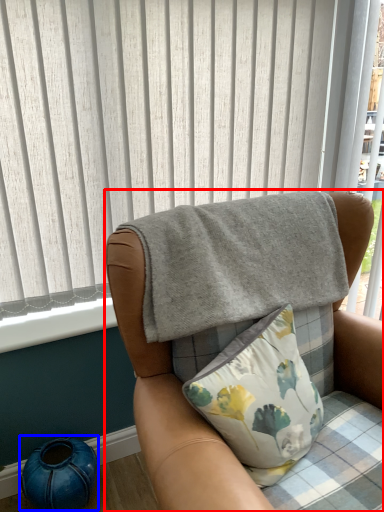
Question: Which of the following is the farthest to the observer, chair (highlighted by a red box) or teal (highlighted by a blue box)?

Choices:
 (A) chair
 (B) teal

Answer: (B)